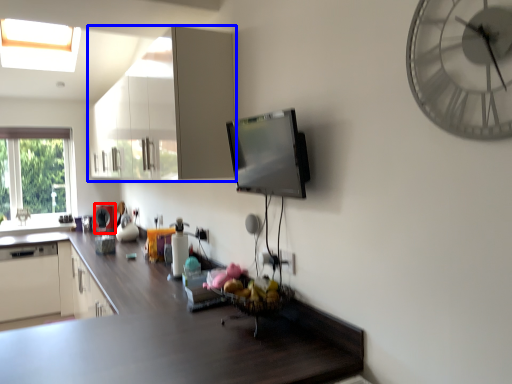
Question: Which object appears farthest to the camera in this image, appliance (highlighted by a red box) or cabinetry (highlighted by a blue box)?

Choices:
 (A) appliance
 (B) cabinetry

Answer: (A)